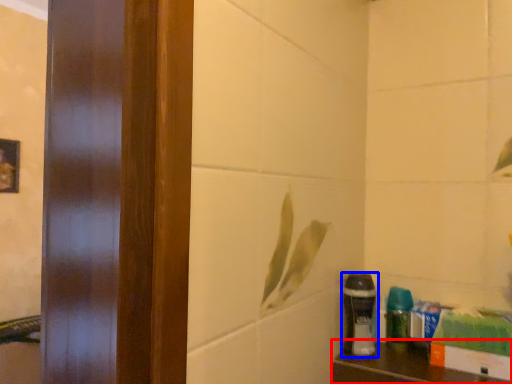
Question: Which object appears farthest to the camera in this image, furniture (highlighted by a red box) or shaving cream (highlighted by a blue box)?

Choices:
 (A) furniture
 (B) shaving cream

Answer: (B)